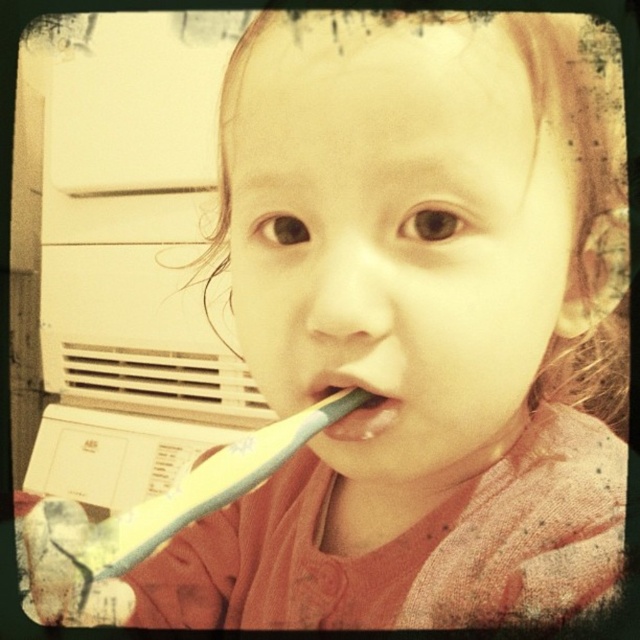
Question: In this image, where is yellow-green plastic toothbrush at center located relative to white matte toothbrush at center?

Choices:
 (A) below
 (B) above

Answer: (A)

Question: Is yellow-green plastic toothbrush at center to the left of white matte toothbrush at center from the viewer's perspective?

Choices:
 (A) yes
 (B) no

Answer: (A)

Question: Does yellow-green plastic toothbrush at center have a larger size compared to white matte toothbrush at center?

Choices:
 (A) no
 (B) yes

Answer: (B)